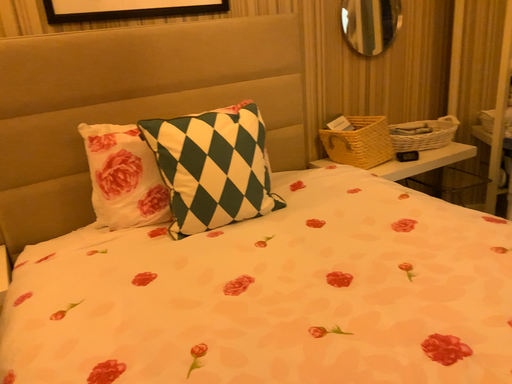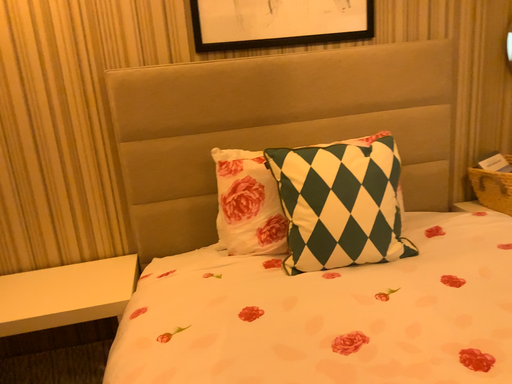
Question: Which way did the camera rotate in the video?

Choices:
 (A) rotated left
 (B) rotated right

Answer: (A)